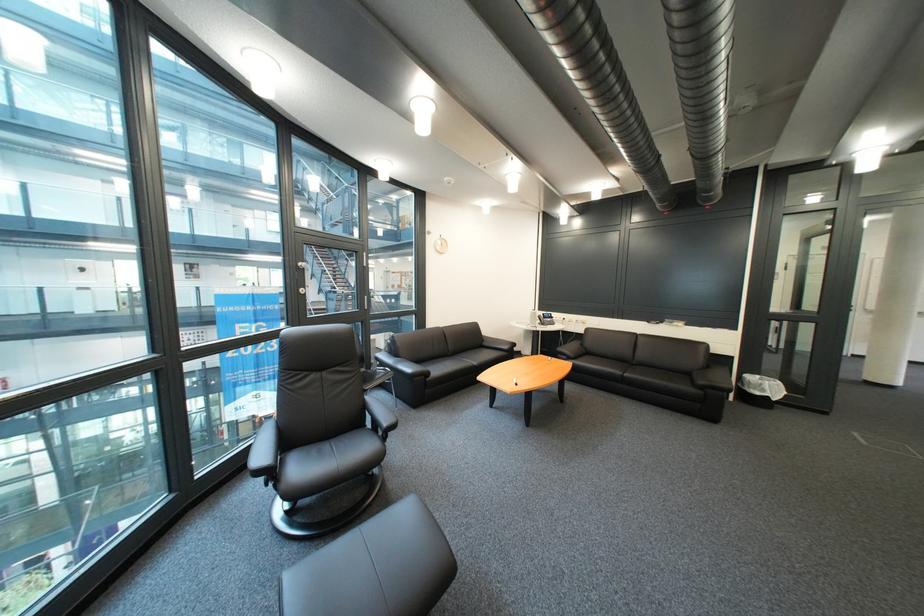
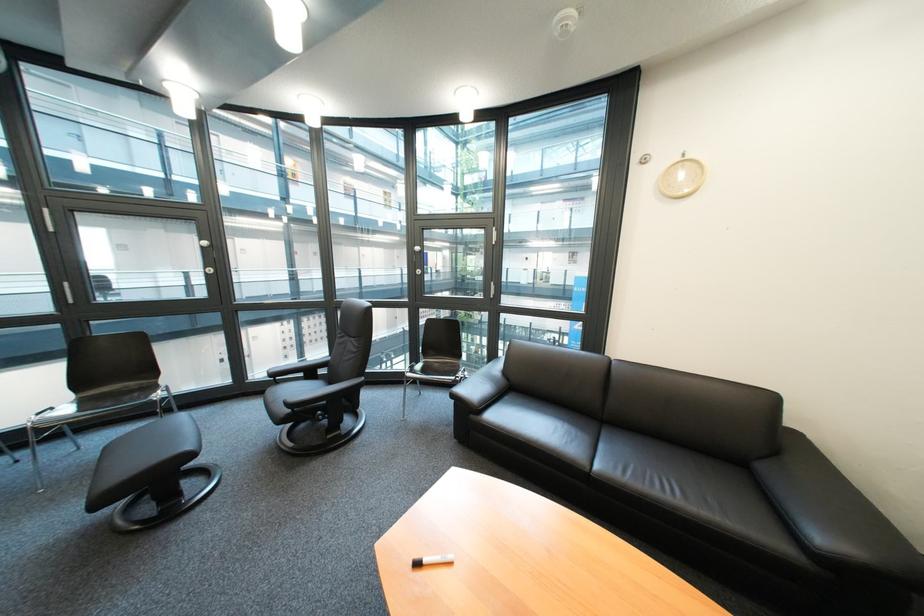
The point at (442, 381) is marked in the first image. Where is the corresponding point in the second image?

(485, 418)